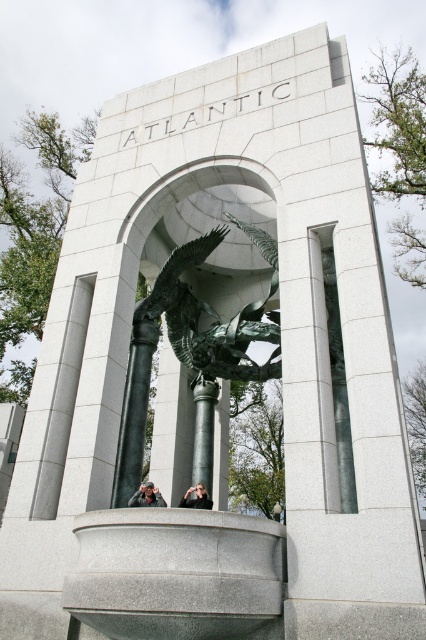
You are standing in front of the monument and want to take a photo of the black polished stone column at center. Where should you position yourself relative to the monument to ensure the column is centered in your photo?

To center the black polished stone column at center in your photo, you should position yourself directly in front of the monument at the point corresponding to the column, as its 2D location is at coordinates (x=204, y=433).